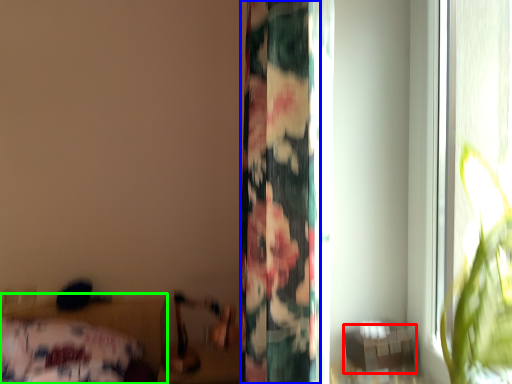
Question: Which is nearer to the table (highlighted by a red box)? curtain (highlighted by a blue box) or bed (highlighted by a green box).

Choices:
 (A) curtain
 (B) bed

Answer: (A)